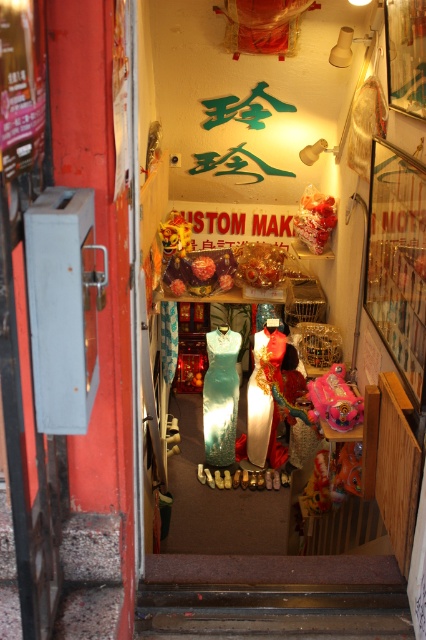
Question: Is shiny green dress at center further to camera compared to shiny pink toy at center?

Choices:
 (A) no
 (B) yes

Answer: (B)

Question: Can you confirm if shiny green dress at center is smaller than matte green dress at center?

Choices:
 (A) yes
 (B) no

Answer: (A)

Question: Does shiny green dress at center have a lesser width compared to shiny pink toy at center?

Choices:
 (A) yes
 (B) no

Answer: (B)

Question: Which of these objects is positioned farthest from the matte green dress at center?

Choices:
 (A) shiny gold lion at center
 (B) shiny green dress at center

Answer: (A)

Question: Among these objects, which one is nearest to the camera?

Choices:
 (A) matte green dress at center
 (B) shiny green dress at center

Answer: (A)

Question: Which object is farther from the camera taking this photo?

Choices:
 (A) matte green dress at center
 (B) shiny green dress at center
 (C) shiny gold lion at center
 (D) shiny pink toy at center

Answer: (B)